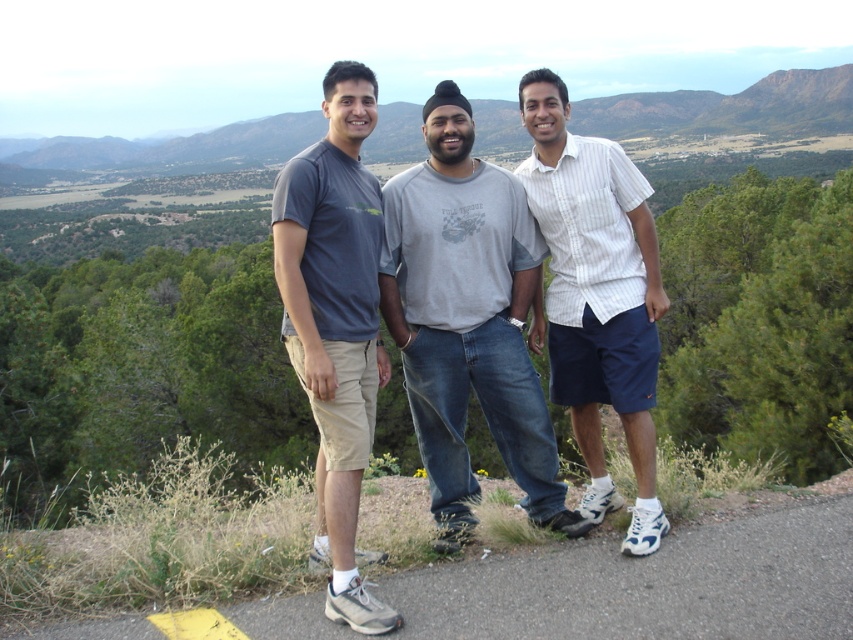
Is point (627, 442) positioned before point (341, 81)?

No, (627, 442) is behind (341, 81).

Between white striped shirt at center and matte gray t-shirt at left, which one is positioned higher?

white striped shirt at center is higher up.

The width and height of the screenshot is (853, 640). What do you see at coordinates (596, 296) in the screenshot?
I see `white striped shirt at center` at bounding box center [596, 296].

This screenshot has width=853, height=640. Find the location of `white striped shirt at center`. white striped shirt at center is located at coordinates (596, 296).

Is gray cotton t-shirt at center to the left of matte gray t-shirt at left from the viewer's perspective?

In fact, gray cotton t-shirt at center is to the right of matte gray t-shirt at left.

Does gray cotton t-shirt at center appear under matte gray t-shirt at left?

No, gray cotton t-shirt at center is not below matte gray t-shirt at left.

This screenshot has height=640, width=853. What are the coordinates of `gray cotton t-shirt at center` in the screenshot? It's located at (467, 320).

Which of these two, gray cotton t-shirt at center or white striped shirt at center, stands shorter?

gray cotton t-shirt at center is shorter.

In the scene shown: Can you confirm if gray cotton t-shirt at center is wider than white striped shirt at center?

Incorrect, gray cotton t-shirt at center's width does not surpass white striped shirt at center's.

Where is `gray cotton t-shirt at center`? gray cotton t-shirt at center is located at coordinates (467, 320).